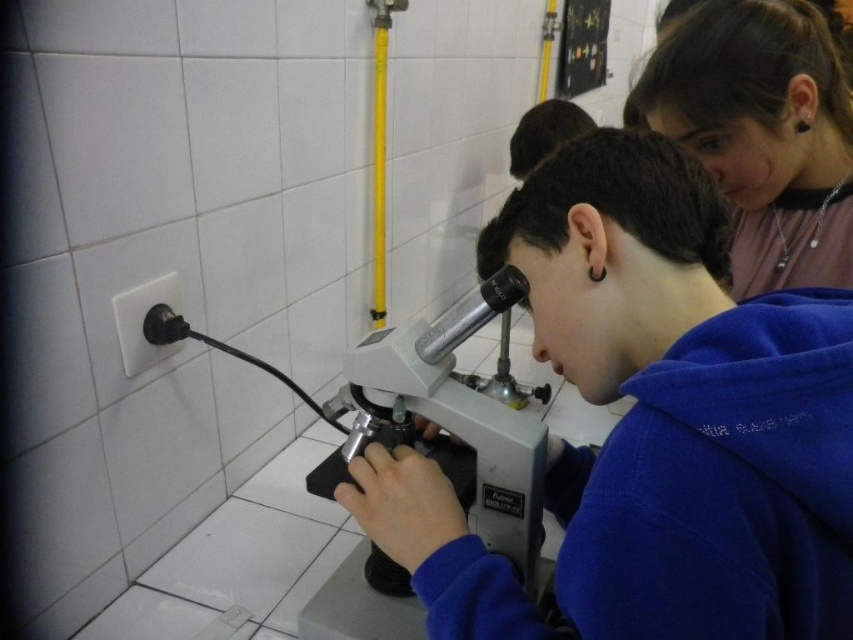
You are a student in the lab and need to place a 1.2 meter wide poster on either the blue fleece at center or the metallic silver bulletin board at upper center. Which surface can accommodate the poster without exceeding its width?

The blue fleece at center has a greater width than the metallic silver bulletin board at upper center, so the poster can be placed on the blue fleece at center.

You are standing in the laboratory and need to place a small note on the nearest object. Which object should you choose between the matte pink shirt at upper right and the metallic silver bulletin board at upper center?

The matte pink shirt at upper right has a smaller size compared to the metallic silver bulletin board at upper center, so the matte pink shirt at upper right is the nearest object and you should place the note there.